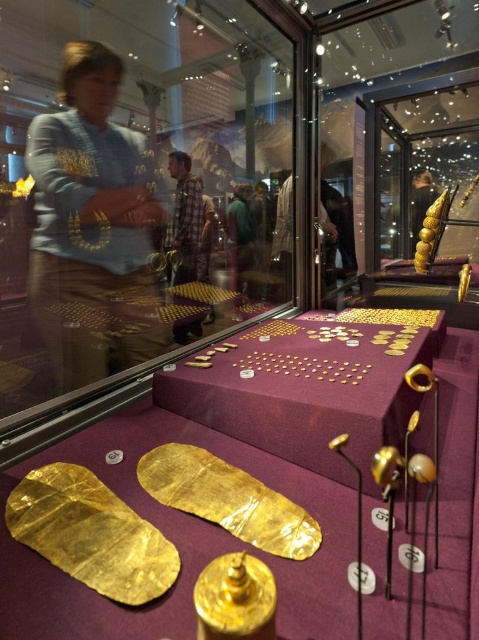
In the scene shown: Is matte gold necklace at upper left positioned before purple velvet table at center?

No, matte gold necklace at upper left is further to the viewer.

From the picture: Is matte gold necklace at upper left shorter than purple velvet table at center?

No, matte gold necklace at upper left is not shorter than purple velvet table at center.

Where is `matte gold necklace at upper left`? The image size is (479, 640). matte gold necklace at upper left is located at coordinates point(92,227).

Can you confirm if purple velvet table at center is smaller than green fabric jacket at center?

No.

This screenshot has width=479, height=640. What do you see at coordinates (305, 390) in the screenshot?
I see `purple velvet table at center` at bounding box center [305, 390].

Image resolution: width=479 pixels, height=640 pixels. In order to click on purple velvet table at center in this screenshot , I will do `click(305, 390)`.

Is shiny gold ring at center shorter than green fabric jacket at center?

Indeed, shiny gold ring at center has a lesser height compared to green fabric jacket at center.

Is shiny gold ring at center above green fabric jacket at center?

Actually, shiny gold ring at center is below green fabric jacket at center.

The height and width of the screenshot is (640, 479). What are the coordinates of `shiny gold ring at center` in the screenshot? It's located at (235, 598).

At what (x,y) coordinates should I click in order to perform the action: click on shiny gold ring at center. Please return your answer as a coordinate pair (x, y). The width and height of the screenshot is (479, 640). Looking at the image, I should click on (235, 598).